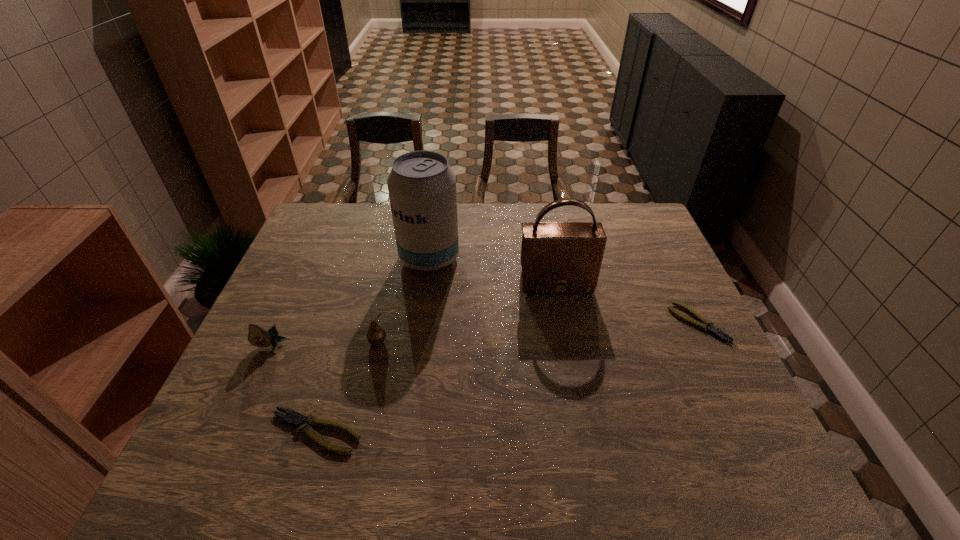
Where is `free point that satisfies the following two spatial constraints: 1. on the front flap of the rightmost object; 2. on the left side of the fifth object from left to right`? The width and height of the screenshot is (960, 540). free point that satisfies the following two spatial constraints: 1. on the front flap of the rightmost object; 2. on the left side of the fifth object from left to right is located at coordinates (564, 322).